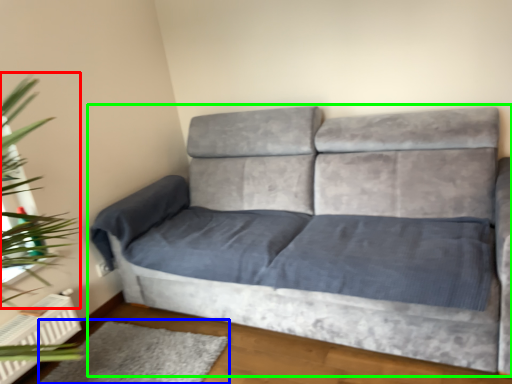
Question: Which object is the closest to the plant (highlighted by a red box)? Choose among these: mat (highlighted by a blue box) or studio couch (highlighted by a green box).

Choices:
 (A) mat
 (B) studio couch

Answer: (A)